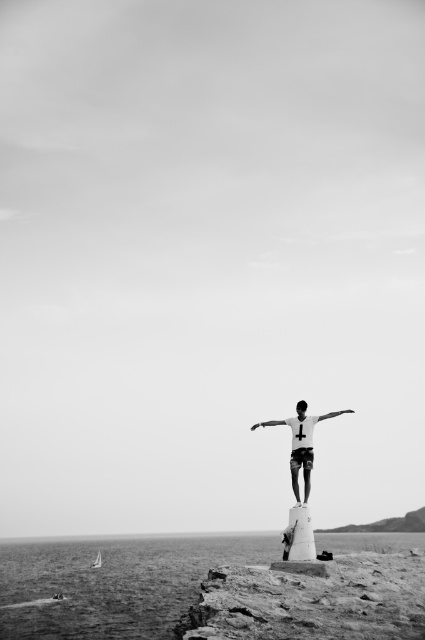
You are a photographer trying to capture the white matte arm at center and the smooth water at lower left in your shot. Based on their positions, which object would appear closer to the camera in the final photograph?

The white matte arm at center appears closer to the camera because it is positioned lower in the frame compared to the smooth water at lower left, which is taller and might be farther away.

You are a photographer trying to capture the white matte arm at center and the smooth water at lower left in the same frame. Based on their positions, can you tell me which object is closer to the left edge of the photo?

The smooth water at lower left is to the left of the white matte arm at center, so the smooth water at lower left is closer to the left edge of the photo.

You are a photographer trying to capture the scene. You notice two white objects at the center of the image. Which one is narrower between the white matte shirt at center and the white matte arm at center?

The white matte shirt at center is thinner than the white matte arm at center, so the white matte shirt at center is narrower.